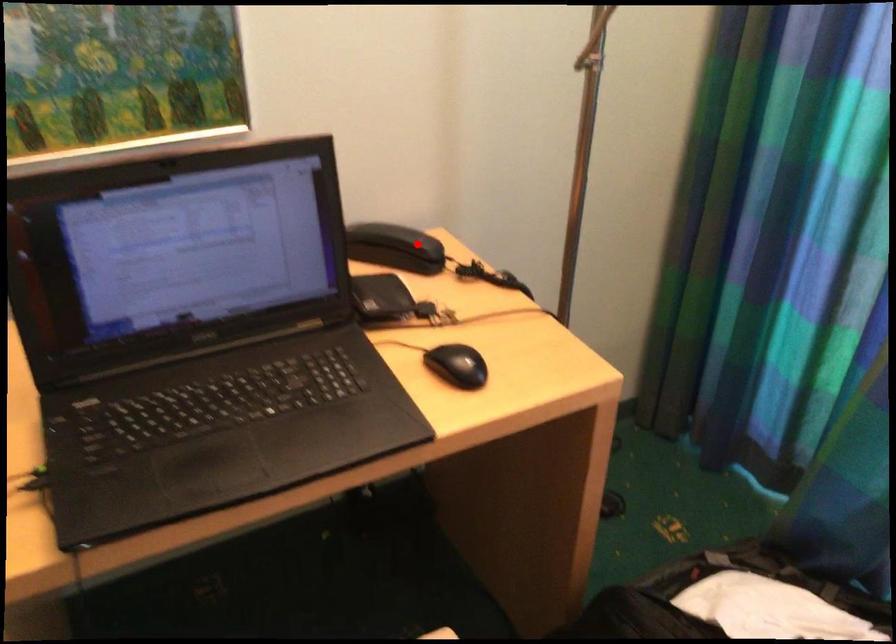
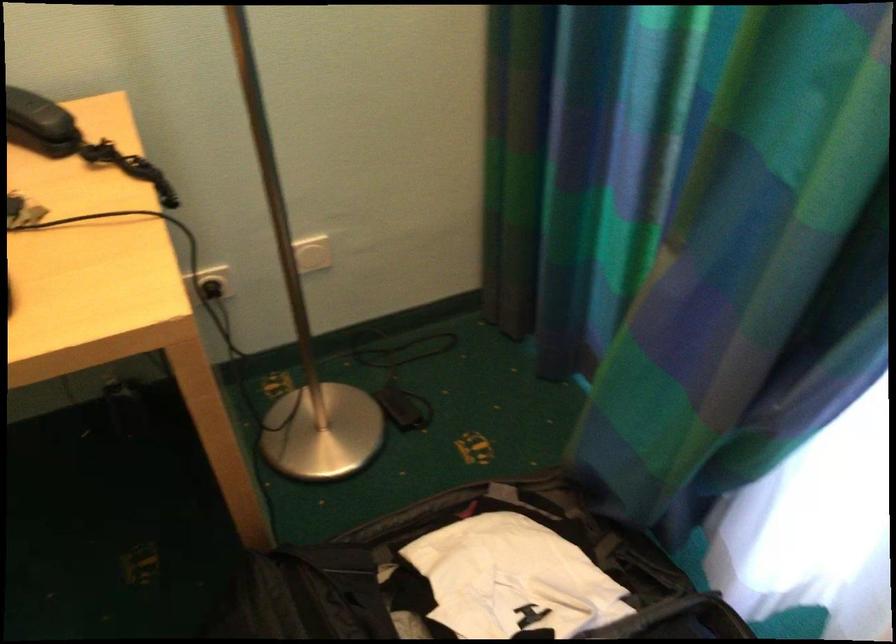
Question: I am providing you with two images of the same scene from different viewpoints. Given a red point in image1, look at the same physical point in image2. Is it:

Choices:
 (A) Closer to the viewpoint
 (B) Farther from the viewpoint

Answer: (A)